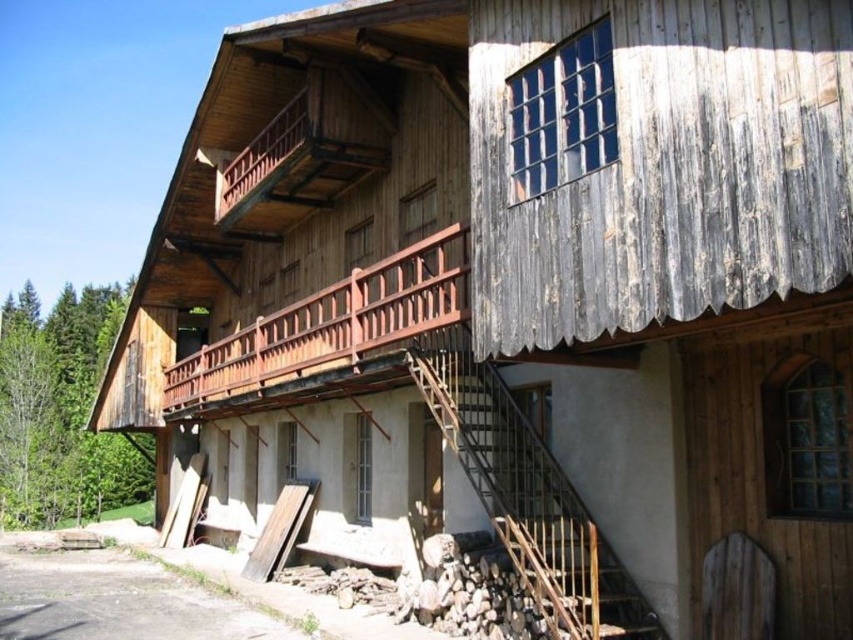
Who is taller, rusty metal staircase at lower right or brown wooden balcony at center?

With more height is brown wooden balcony at center.

Does point (496, 404) come behind point (270, 323)?

No, it is not.

Who is more forward, [497,512] or [450,316]?

Positioned in front is point [450,316].

At what (x,y) coordinates should I click in order to perform the action: click on rusty metal staircase at lower right. Please return your answer as a coordinate pair (x, y). Looking at the image, I should click on (531, 499).

In the scene shown: Can you confirm if rusty metal staircase at lower right is bigger than brown wooden balcony at upper center?

Yes.

Which is in front, point (467, 465) or point (271, 150)?

Positioned in front is point (467, 465).

Is point (606, 625) closer to camera compared to point (306, 200)?

Yes.

Locate an element on the screen. Image resolution: width=853 pixels, height=640 pixels. rusty metal staircase at lower right is located at coordinates (531, 499).

Measure the distance between point (199, 362) and camera.

They are 63.66 feet apart.

Is the position of brown wooden balcony at center more distant than that of brown wooden balcony at upper center?

That is False.

Describe the element at coordinates (328, 330) in the screenshot. I see `brown wooden balcony at center` at that location.

Find the location of `brown wooden balcony at center`. brown wooden balcony at center is located at coordinates (328, 330).